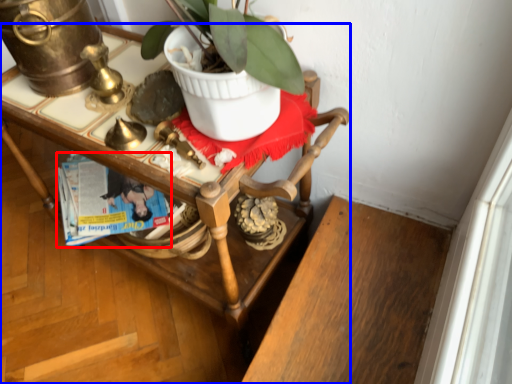
Question: Which object is closer to the camera taking this photo, magazine (highlighted by a red box) or desk (highlighted by a blue box)?

Choices:
 (A) magazine
 (B) desk

Answer: (B)